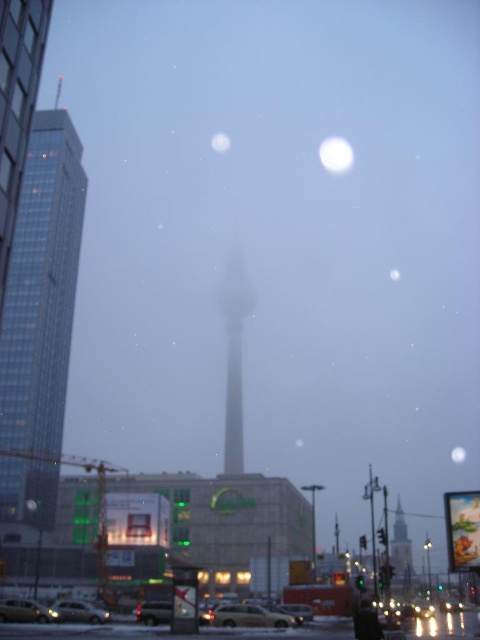
Which is more to the left, matte silver sedan at lower left or white glossy moon at upper center?

From the viewer's perspective, matte silver sedan at lower left appears more on the left side.

Does matte silver sedan at lower left appear on the right side of white glossy moon at upper center?

No, matte silver sedan at lower left is not to the right of white glossy moon at upper center.

Between point (84, 609) and point (218, 138), which one is positioned in front?

Point (84, 609)

Identify the location of matte silver sedan at lower left. The image size is (480, 640). (79, 611).

Is glassy skyscraper at left to the left of white glossy moon at upper center from the viewer's perspective?

Indeed, glassy skyscraper at left is positioned on the left side of white glossy moon at upper center.

Does glassy skyscraper at left have a lesser height compared to white glossy moon at upper center?

No, glassy skyscraper at left is not shorter than white glossy moon at upper center.

Which is behind, point (32, 164) or point (225, 141)?

The point (225, 141) is behind.

At what (x,y) coordinates should I click in order to perform the action: click on glassy skyscraper at left. Please return your answer as a coordinate pair (x, y). Image resolution: width=480 pixels, height=640 pixels. Looking at the image, I should click on (41, 288).

Which of these two, metallic silver car at center or white glossy moon at center, stands taller?

metallic silver car at center

Is point (139, 611) positioned before point (464, 458)?

Yes, point (139, 611) is in front of point (464, 458).

The image size is (480, 640). I want to click on metallic silver car at center, so click(x=154, y=612).

Locate an element on the screen. The width and height of the screenshot is (480, 640). metallic silver car at center is located at coordinates (154, 612).